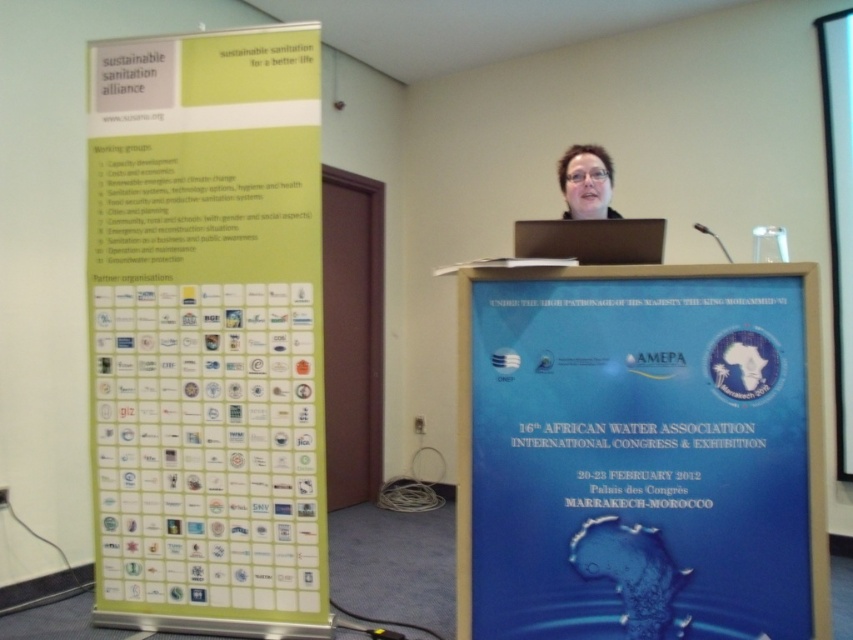
Looking at this image, you are an attendee at the conference and need to present your findings. You have a large poster to display. Which object, the green paper poster at left or the matte black screen at center, would be more suitable for mounting your poster given their sizes?

The green paper poster at left has a larger size compared to the matte black screen at center, so it would be more suitable for mounting your large poster.

You are attending the conference and notice the speaker. Which object is located below the other between the matte black screen at center and the matte black hair at upper center?

The matte black screen at center is positioned under the matte black hair at upper center.

In the scene shown: You are standing at the center of the conference room. You need to find the green paper poster at left. Based on the scene description, where should you look relative to the podium?

The green paper poster at left is located at the left side of the podium, specifically at the 2D coordinates point (207, 332).